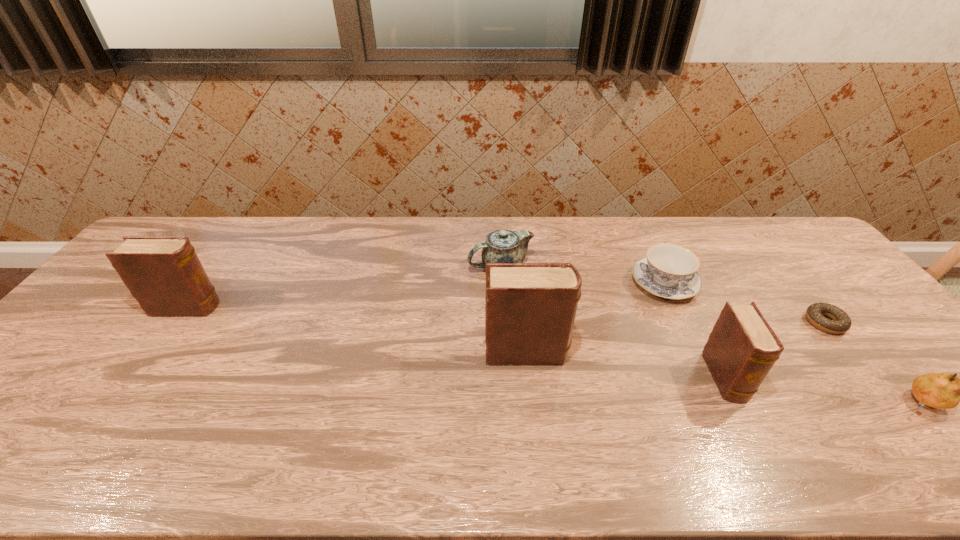
Where is `free spot located 0.240m on the spine side of the leftmost object`? This screenshot has height=540, width=960. free spot located 0.240m on the spine side of the leftmost object is located at coordinates (302, 307).

Where is `vacant space situated on the spine side of the second diary from left to right`? Image resolution: width=960 pixels, height=540 pixels. vacant space situated on the spine side of the second diary from left to right is located at coordinates (692, 352).

Locate an element on the screen. The width and height of the screenshot is (960, 540). blank area located from the spout of the left chinaware is located at coordinates pyautogui.click(x=371, y=266).

Identify the location of vacant space located 0.110m from the spout of the left chinaware. This screenshot has width=960, height=540. (433, 266).

Where is `vacant area situated from the spout of the left chinaware`? The image size is (960, 540). vacant area situated from the spout of the left chinaware is located at coordinates (343, 266).

Find the location of a particular element. This screenshot has width=960, height=540. vacant space located 0.350m on the back of the shortest object is located at coordinates (756, 238).

The height and width of the screenshot is (540, 960). I want to click on vacant position located with the handle on the side of the shorter chinaware, so click(x=640, y=233).

You are a GUI agent. You are given a task and a screenshot of the screen. Output one action in this format:
    pyautogui.click(x=<x>, y=<y>)
    Task: Click on the free spot located 0.160m with the handle on the side of the shorter chinaware
    This screenshot has height=540, width=960.
    Given the screenshot: What is the action you would take?
    pyautogui.click(x=640, y=233)

The width and height of the screenshot is (960, 540). I want to click on vacant region located with the handle on the side of the shorter chinaware, so click(641, 234).

The height and width of the screenshot is (540, 960). In order to click on free location located on the back of the pear in this screenshot , I will do `click(840, 310)`.